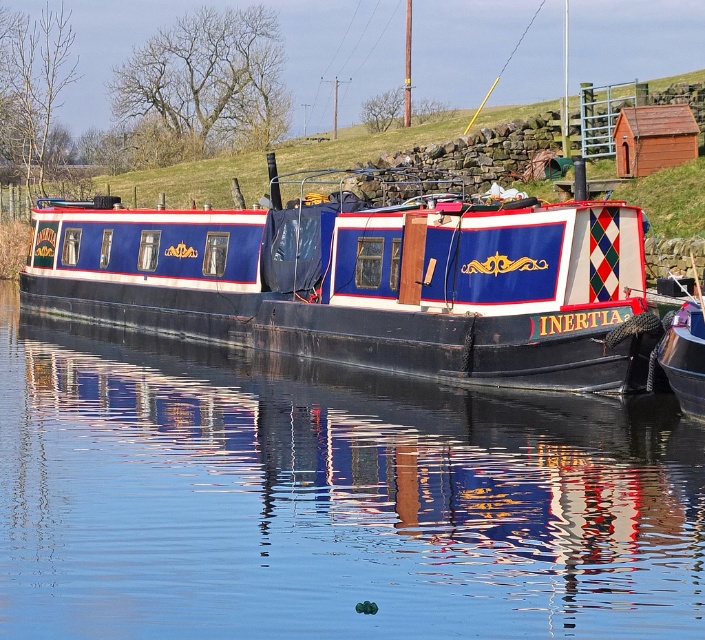
You are a delivery person who needs to place a 1.5 meter wide package on the glossy black water at center or the blue painted wood barge at center. Which surface can safely hold the package?

The blue painted wood barge at center can safely hold the 1.5 meter wide package because its width is greater than the glossy black water at center.

You are standing on the dock and want to take a photo of the boat INERTIA. Where should you position yourself to capture the glossy black water at center in the reflection?

The glossy black water at center is located at point (329, 499), so you should position yourself directly above or near that coordinate to capture the reflection.